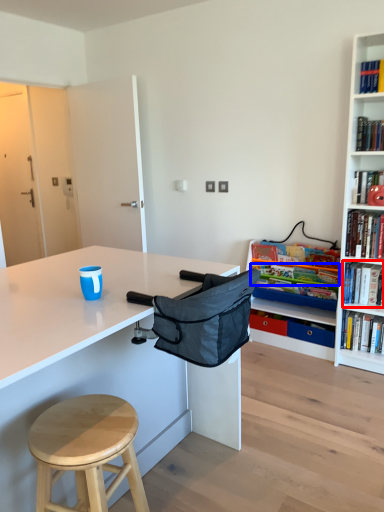
Question: Which object is further to the camera taking this photo, book (highlighted by a red box) or book (highlighted by a blue box)?

Choices:
 (A) book
 (B) book

Answer: (B)